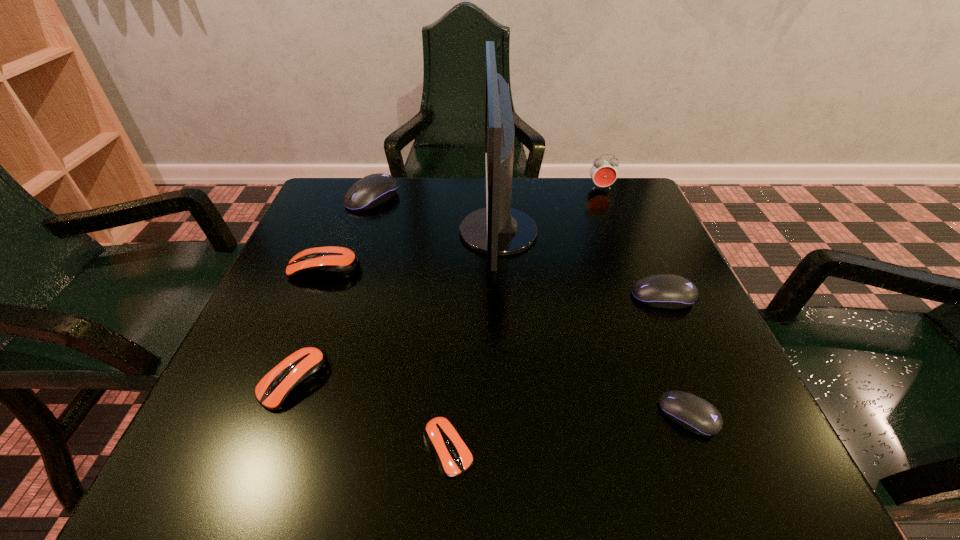
The height and width of the screenshot is (540, 960). Identify the location of vacant space that satisfies the following two spatial constraints: 1. on the front side of the biggest black computer mouse; 2. on the left side of the third farthest computer mouse. (339, 297).

Find the location of a particular element. free location that satisfies the following two spatial constraints: 1. on the back side of the shortest computer mouse; 2. on the right side of the smallest black computer mouse is located at coordinates click(450, 415).